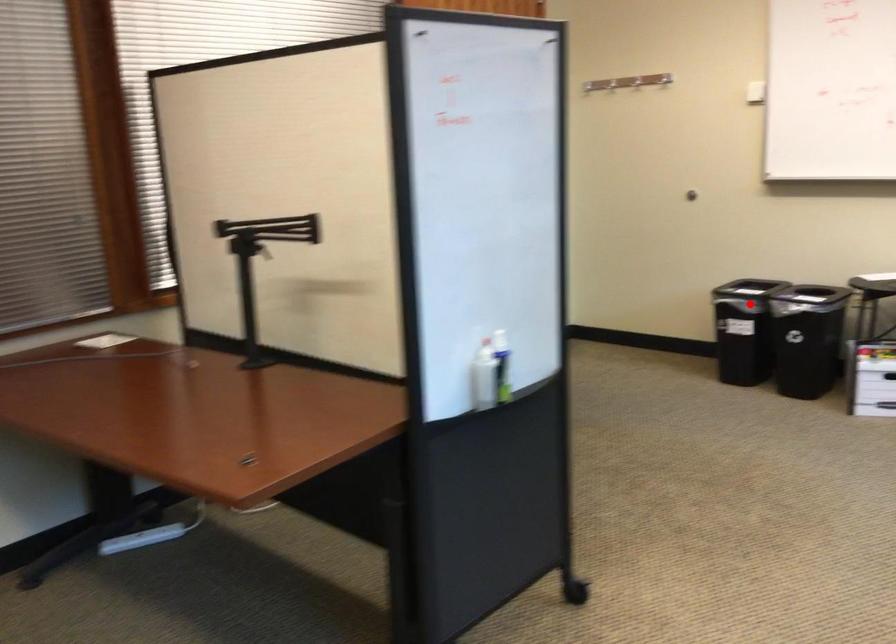
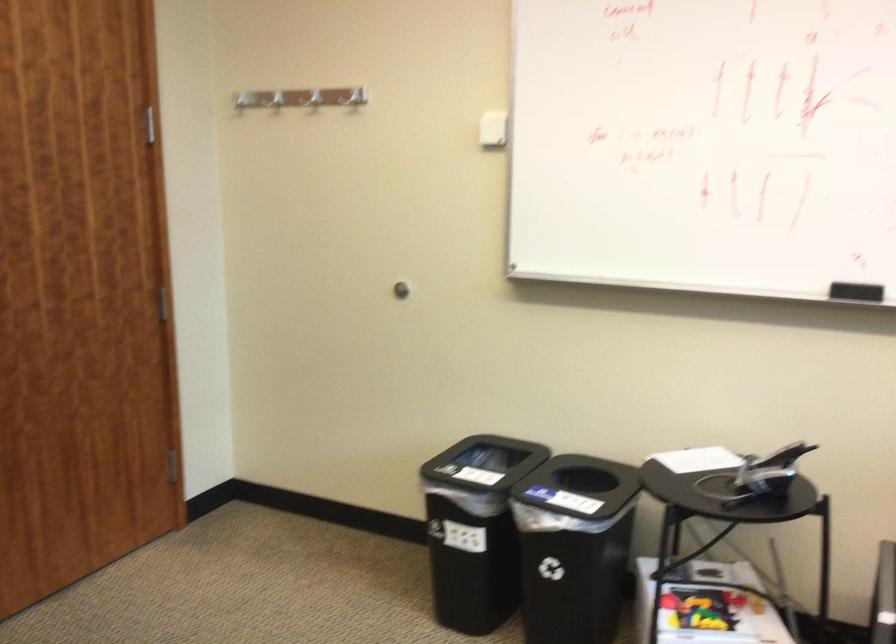
Question: I am providing you with two images of the same scene from different viewpoints. A red point is shown in image1. For the corresponding object point in image2, is it positioned nearer or farther from the camera?

Choices:
 (A) Nearer
 (B) Farther

Answer: (A)